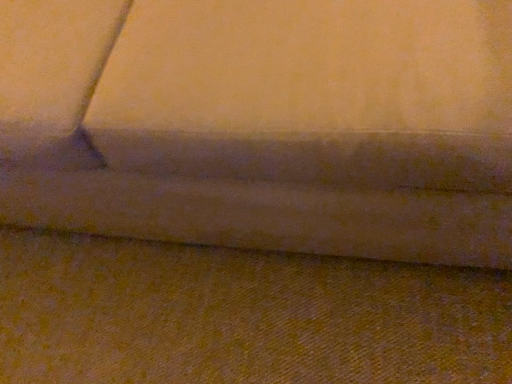
Question: Considering the relative positions of velvet-like fabric couch at center and yellow fabric at lower center in the image provided, is velvet-like fabric couch at center to the left or to the right of yellow fabric at lower center?

Choices:
 (A) right
 (B) left

Answer: (B)

Question: Considering their positions, is velvet-like fabric couch at center located in front of or behind yellow fabric at lower center?

Choices:
 (A) front
 (B) behind

Answer: (A)

Question: In terms of size, does velvet-like fabric couch at center appear bigger or smaller than yellow fabric at lower center?

Choices:
 (A) small
 (B) big

Answer: (B)

Question: Is yellow fabric at lower center to the left or to the right of velvet-like fabric couch at center in the image?

Choices:
 (A) right
 (B) left

Answer: (A)

Question: Is yellow fabric at lower center taller or shorter than velvet-like fabric couch at center?

Choices:
 (A) tall
 (B) short

Answer: (B)

Question: Considering their positions, is yellow fabric at lower center located in front of or behind velvet-like fabric couch at center?

Choices:
 (A) front
 (B) behind

Answer: (B)

Question: Does point (75, 311) appear closer or farther from the camera than point (295, 163)?

Choices:
 (A) farther
 (B) closer

Answer: (A)